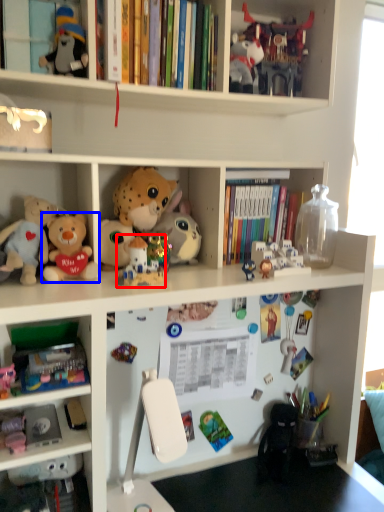
Question: Among these objects, which one is nearest to the camera, toy (highlighted by a red box) or toy (highlighted by a blue box)?

Choices:
 (A) toy
 (B) toy

Answer: (B)